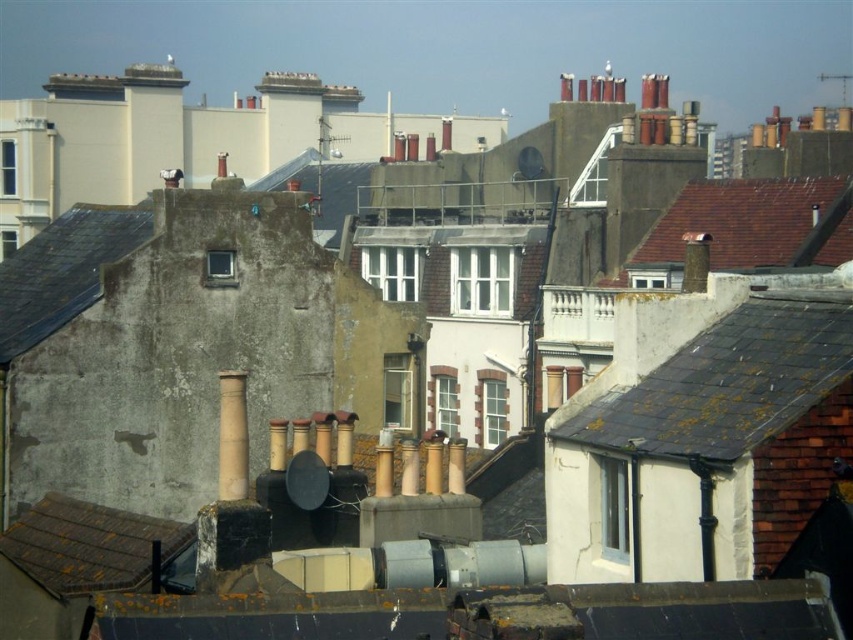
Which of these two, brown tile roof at lower left or brown clay chimney at center, stands shorter?

→ Standing shorter between the two is brown tile roof at lower left.

The height and width of the screenshot is (640, 853). I want to click on brown tile roof at lower left, so click(86, 545).

Identify the location of brown tile roof at lower left. The width and height of the screenshot is (853, 640). (86, 545).

Between point (769, 262) and point (230, 410), which one is positioned behind?

Point (769, 262)

Can you confirm if brown tiled roof at upper right is positioned below brown clay chimney at center?

Actually, brown tiled roof at upper right is above brown clay chimney at center.

Does point (772, 195) lie behind point (242, 426)?

That is True.

Where is `brown tiled roof at upper right`? Image resolution: width=853 pixels, height=640 pixels. brown tiled roof at upper right is located at coordinates (753, 225).

Can you confirm if brown tiled roof at upper right is positioned to the left of brown tile roof at lower left?

No, brown tiled roof at upper right is not to the left of brown tile roof at lower left.

Find the location of a particular element. The image size is (853, 640). brown tiled roof at upper right is located at coordinates (753, 225).

Is point (764, 241) in front of point (132, 557)?

No, (764, 241) is further to viewer.

What are the coordinates of `brown tiled roof at upper right` in the screenshot? It's located at (753, 225).